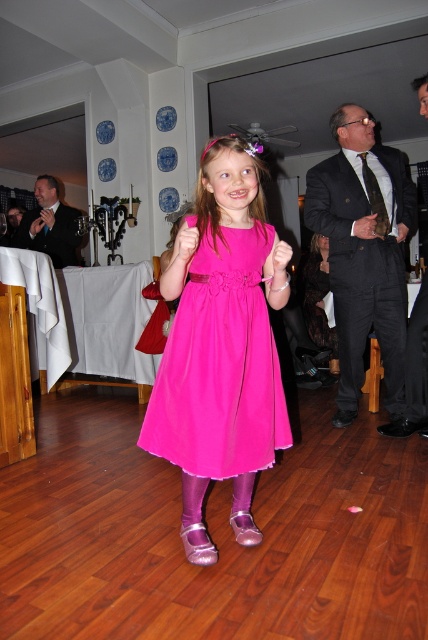
Question: Where is fuchsia chiffon dress at center located in relation to black textured suit at upper right in the image?

Choices:
 (A) below
 (B) above

Answer: (A)

Question: Can you confirm if fuchsia chiffon dress at center is positioned to the right of black textured suit at upper right?

Choices:
 (A) yes
 (B) no

Answer: (B)

Question: Does fuchsia chiffon dress at center appear on the left side of black textured suit at upper right?

Choices:
 (A) yes
 (B) no

Answer: (A)

Question: Which object appears farthest from the camera in this image?

Choices:
 (A) black textured suit at upper right
 (B) fuchsia chiffon dress at center

Answer: (A)

Question: Which object appears farthest from the camera in this image?

Choices:
 (A) fuchsia chiffon dress at center
 (B) black textured suit at upper right

Answer: (B)